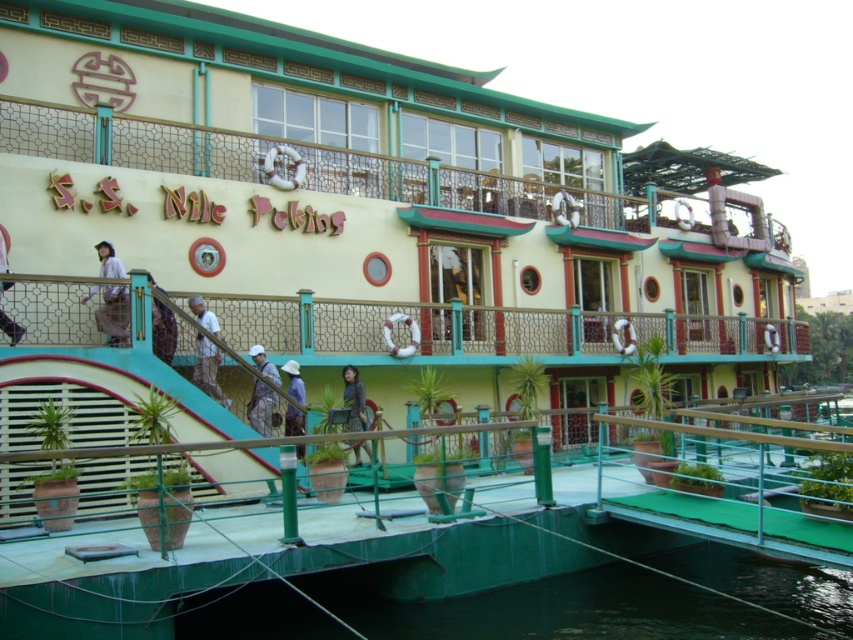
You are a passenger on the S.S. Nile Pekins and need to place a matte black jacket at center on a light brown wooden stairs at center. Based on their sizes, will the jacket fit on the stairs without overlapping the edges?

The matte black jacket at center has a larger width than the light brown wooden stairs at center, so placing the jacket on the stairs would cause it to overlap the edges since it is wider than the stairs.

You are a construction worker on the S.S. Nile Pekins houseboat and need to locate your safety gear. You remember placing a white hard hat at center and a blue fabric hat at center somewhere near the middle of the boat. Which hat is positioned more to the left?

The white hard hat at center is positioned more to the left compared to the blue fabric hat at center.

You are standing on the deck of the S.S. Nile Pekins and notice two hats on the upper level. The white hard hat at center and the blue fabric hat at center. Which hat is nearer to you?

The white hard hat at center is closer to the viewer than the blue fabric hat at center, so the white hard hat at center is nearer to you.